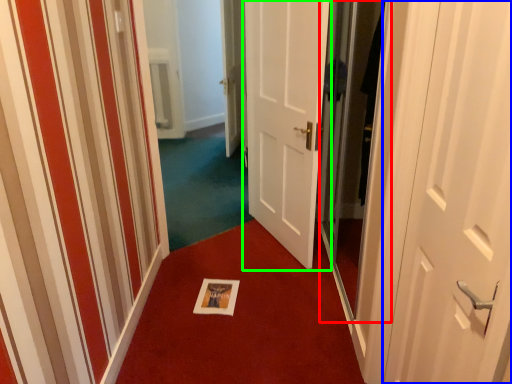
Question: Which object is the closest to the screen door (highlighted by a red box)? Choose among these: door (highlighted by a blue box) or door (highlighted by a green box).

Choices:
 (A) door
 (B) door

Answer: (B)